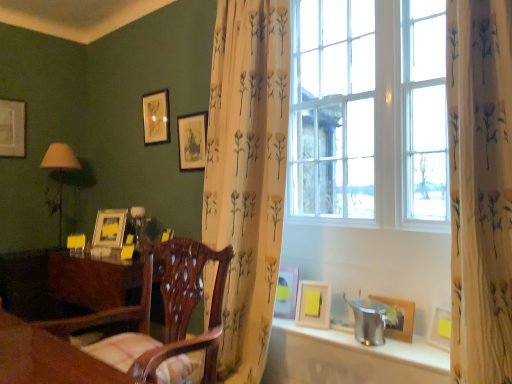
The width and height of the screenshot is (512, 384). Find the location of `vacant position to the left of matte white picture frame at upper right, arranged as the second picture frame when viewed from the right`. vacant position to the left of matte white picture frame at upper right, arranged as the second picture frame when viewed from the right is located at coordinates 285,323.